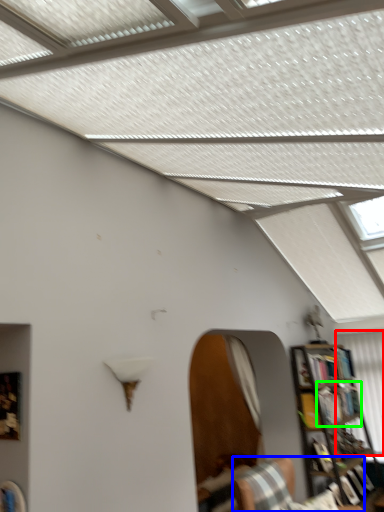
Question: Which object is positioned closest to curtain (highlighted by a red box)? Select from furniture (highlighted by a blue box) and book (highlighted by a green box).

Choices:
 (A) furniture
 (B) book

Answer: (B)